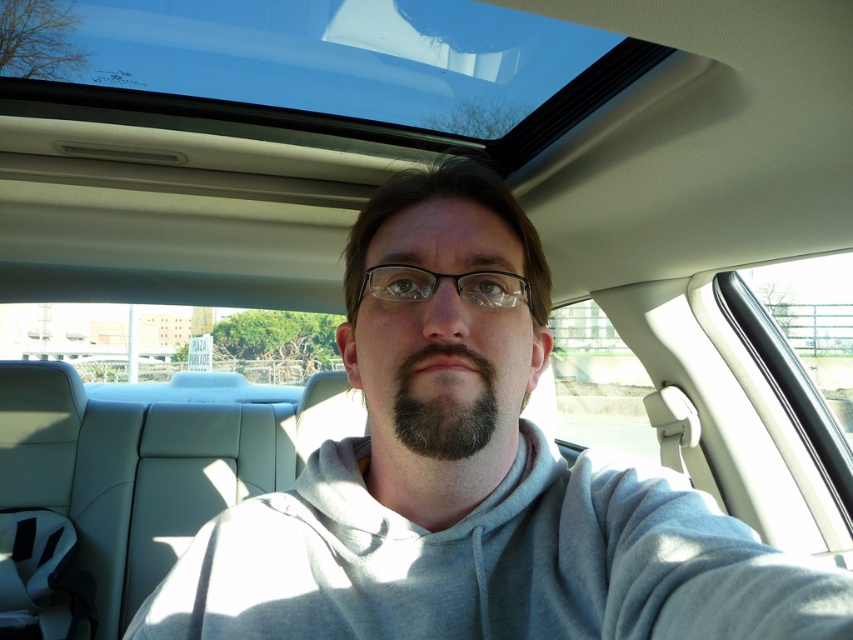
Question: Does transparent glass sunroof at upper center have a larger size compared to black plastic glasses at center?

Choices:
 (A) yes
 (B) no

Answer: (A)

Question: Is transparent glass sunroof at upper center smaller than dark brown fuzzy beard at center?

Choices:
 (A) yes
 (B) no

Answer: (B)

Question: Which object appears closest to the camera in this image?

Choices:
 (A) transparent glass sunroof at upper center
 (B) black plastic glasses at center
 (C) dark brown fuzzy beard at center

Answer: (C)

Question: Is dark brown fuzzy beard at center thinner than black plastic glasses at center?

Choices:
 (A) yes
 (B) no

Answer: (A)

Question: Which is nearer to the dark brown fuzzy beard at center?

Choices:
 (A) transparent glass sunroof at upper center
 (B) black plastic glasses at center

Answer: (B)

Question: Which object is closer to the camera taking this photo?

Choices:
 (A) black plastic glasses at center
 (B) transparent glass sunroof at upper center
 (C) dark brown fuzzy beard at center

Answer: (C)